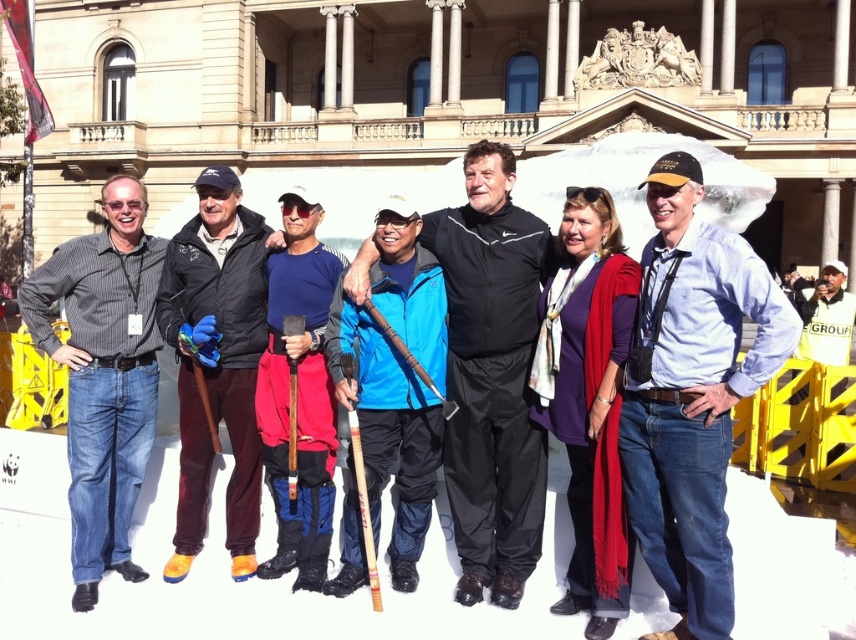
You are organizing a charity event and need to decide which clothing item to use as a prop. The striped cotton shirt at left and the dark brown leather jacket at center are available. Which item has a bigger size?

The striped cotton shirt at left has a larger size compared to the dark brown leather jacket at center, so the striped cotton shirt at left is the bigger item.

You are standing in front of the classical building and see two blue items at center. Which one is nearer to you, the blue softshell jacket at center or the blue fabric shirt at center?

The blue softshell jacket at center is closer to the viewer than the blue fabric shirt at center.